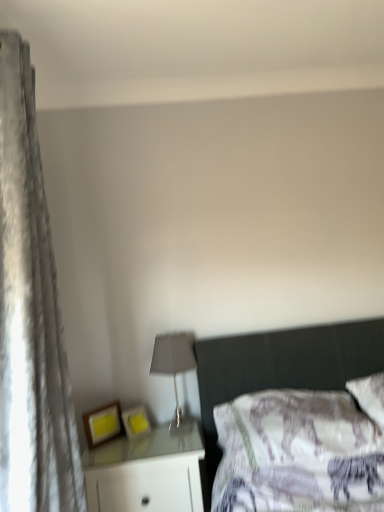
Question: Does white glossy nightstand at lower left have a lesser width compared to matte gray lampshade at center?

Choices:
 (A) yes
 (B) no

Answer: (B)

Question: Does white glossy nightstand at lower left lie in front of matte gray lampshade at center?

Choices:
 (A) yes
 (B) no

Answer: (A)

Question: Does white glossy nightstand at lower left have a lesser height compared to matte gray lampshade at center?

Choices:
 (A) yes
 (B) no

Answer: (B)

Question: From the image's perspective, is white glossy nightstand at lower left above matte gray lampshade at center?

Choices:
 (A) yes
 (B) no

Answer: (B)

Question: Is white glossy nightstand at lower left not within matte gray lampshade at center?

Choices:
 (A) no
 (B) yes

Answer: (B)

Question: Does white glossy nightstand at lower left lie behind matte gray lampshade at center?

Choices:
 (A) no
 (B) yes

Answer: (A)

Question: Considering the relative positions of white glossy nightstand at lower left and matte wooden picture frame at lower left, which is the first picture frame in left-to-right order, in the image provided, is white glossy nightstand at lower left to the left of matte wooden picture frame at lower left, which is the first picture frame in left-to-right order, from the viewer's perspective?

Choices:
 (A) no
 (B) yes

Answer: (A)

Question: Does white glossy nightstand at lower left have a greater height compared to matte wooden picture frame at lower left, which ranks as the 2th picture frame in right-to-left order?

Choices:
 (A) yes
 (B) no

Answer: (A)

Question: Is white glossy nightstand at lower left further to the viewer compared to matte wooden picture frame at lower left, which is the first picture frame in left-to-right order?

Choices:
 (A) yes
 (B) no

Answer: (B)

Question: Is white glossy nightstand at lower left positioned before matte wooden picture frame at lower left, which ranks as the 2th picture frame in right-to-left order?

Choices:
 (A) yes
 (B) no

Answer: (A)

Question: Considering the relative sizes of white glossy nightstand at lower left and matte wooden picture frame at lower left, which ranks as the 2th picture frame in right-to-left order, in the image provided, is white glossy nightstand at lower left thinner than matte wooden picture frame at lower left, which ranks as the 2th picture frame in right-to-left order,?

Choices:
 (A) no
 (B) yes

Answer: (A)

Question: Is white glossy nightstand at lower left outside of matte wooden picture frame at lower left, which ranks as the 2th picture frame in right-to-left order?

Choices:
 (A) yes
 (B) no

Answer: (A)

Question: Does matte wooden picture frame at lower left, which ranks as the 2th picture frame in right-to-left order, appear on the left side of matte gray lampshade at center?

Choices:
 (A) no
 (B) yes

Answer: (B)